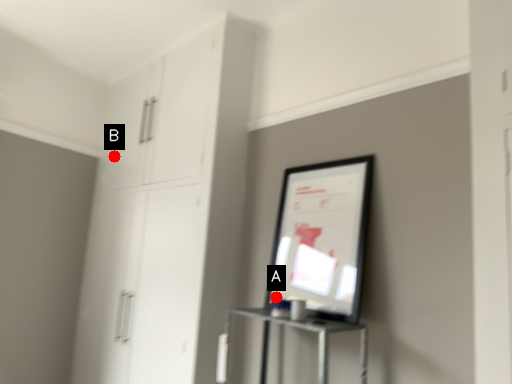
Question: Two points are circled on the image, labeled by A and B beside each circle. Which point is further to the camera?

Choices:
 (A) A is further
 (B) B is further

Answer: (B)